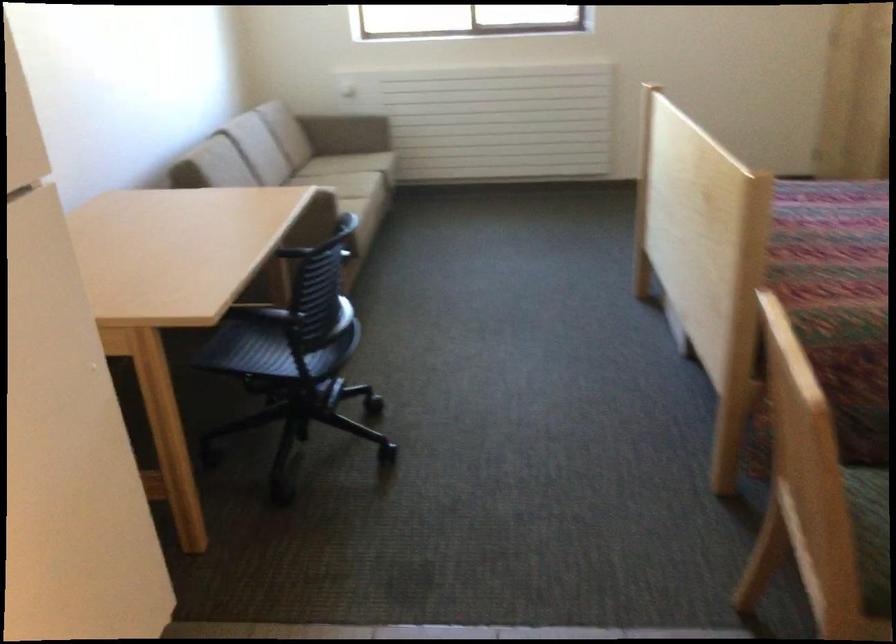
The height and width of the screenshot is (644, 896). Find the location of `chair armrest`. chair armrest is located at coordinates (328, 198).